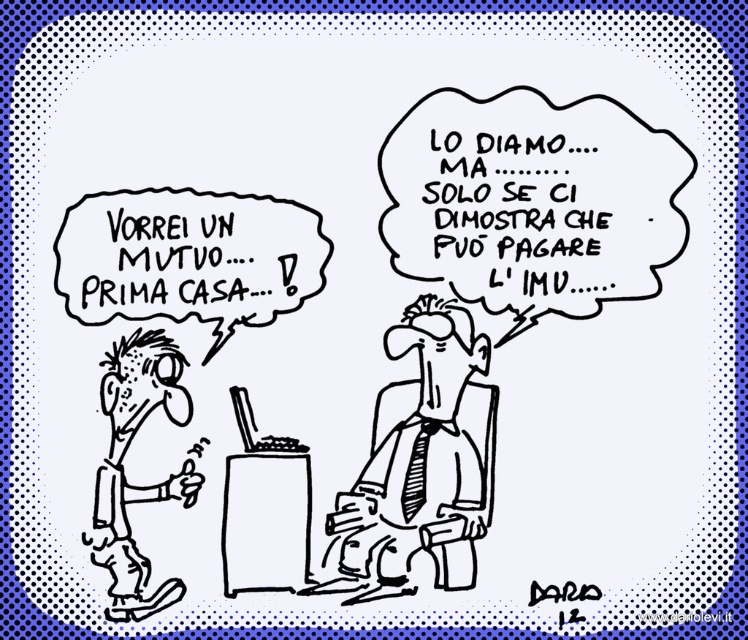
Is point (364, 528) farther from camera compared to point (123, 397)?

Yes, point (364, 528) is behind point (123, 397).

Describe the element at coordinates (420, 461) in the screenshot. I see `black ink pen at center` at that location.

Is point (447, 460) positioned in front of point (144, 340)?

No, it is not.

The height and width of the screenshot is (640, 748). Find the location of `black ink pen at center`. black ink pen at center is located at coordinates (420, 461).